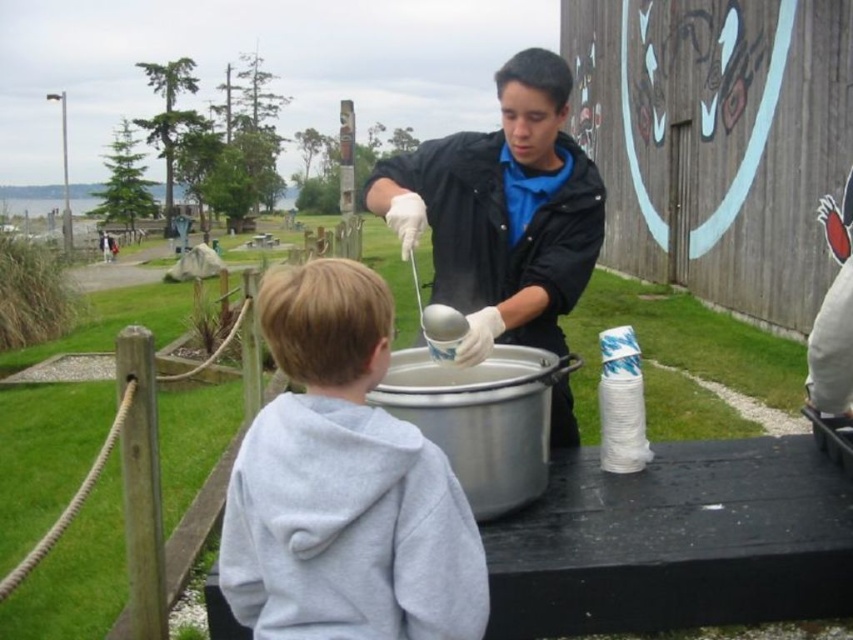
You are a delivery person who needs to place a small package between the gray fleece hoodie at lower left and the white glossy bowl at center. The package is 1.2 meters long. Can you fit the package between them without moving either object?

The distance between the gray fleece hoodie at lower left and the white glossy bowl at center is 1.14 meters. Since the package is 1.2 meters long, it cannot fit between them without moving either object.

You are standing in the park and want to hand the white glossy bowl at center to the person wearing the gray fleece hoodie at lower left. Can you directly hand it to them without moving the bowl?

The gray fleece hoodie at lower left is closer to the viewer than the white glossy bowl at center, so you can directly hand the white glossy bowl at center to the person wearing the gray fleece hoodie at lower left without moving the bowl.